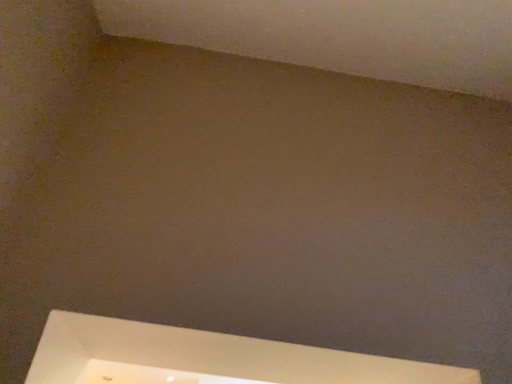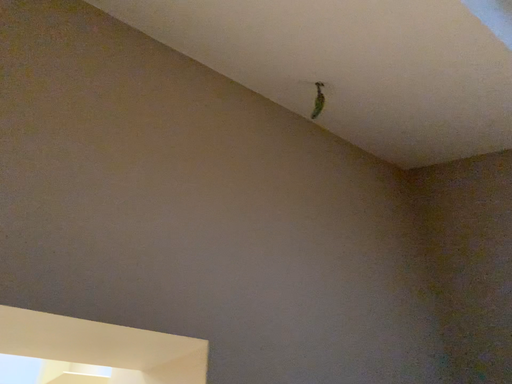
Question: Which way did the camera rotate in the video?

Choices:
 (A) rotated right
 (B) rotated left

Answer: (A)